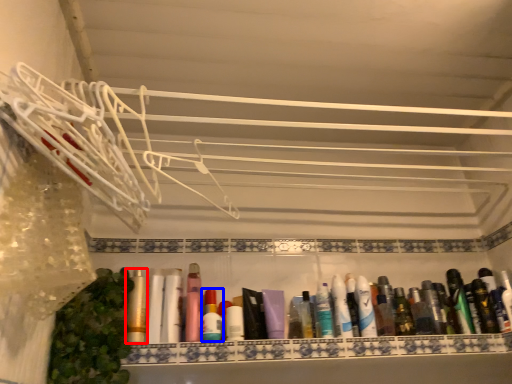
Question: Which of the following is the farthest to the observer, toiletry (highlighted by a red box) or toiletry (highlighted by a blue box)?

Choices:
 (A) toiletry
 (B) toiletry

Answer: (B)